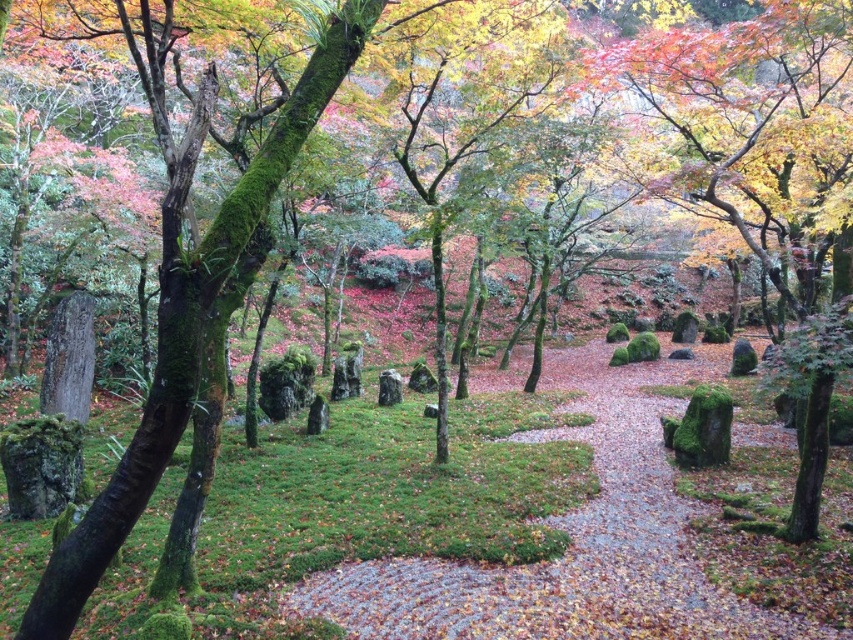
You are a gardener planning to clear the autumn leaves at center and the green mossy tree at left. Which area requires a wider path to accommodate the removal of the leaves?

The autumn leaves at center require a wider path since their width is larger than the green mossy tree at left.

You are a gardener planning to clear the autumn leaves at center and the green mossy tree at left. Which object requires more physical effort to handle due to its size?

The autumn leaves at center require more physical effort to handle because they have a larger size compared to the green mossy tree at left.